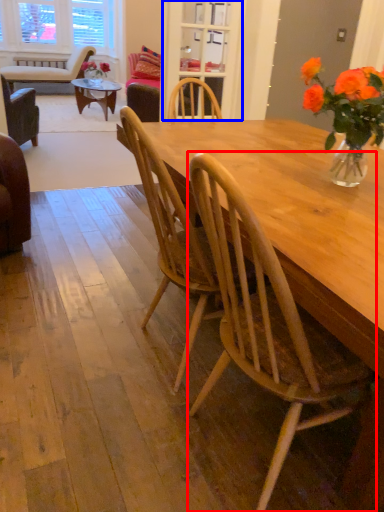
Question: Which object appears farthest to the camera in this image, chair (highlighted by a red box) or glass door (highlighted by a blue box)?

Choices:
 (A) chair
 (B) glass door

Answer: (B)